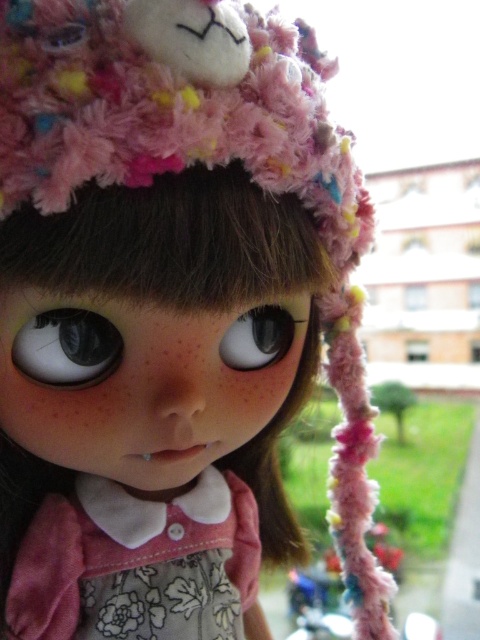
Please describe the position of the matte black eye at center in terms of coordinates. The answer should be in the format of coordinates in parentheses. The coordinate system is normalized, where the origin is at the bottom left corner of the image, and the x and y axes increase to the right and up respectively. The coordinates are given as fractions between 0 and 1.

The matte black eye at center is located at coordinates point (67, 348).

You are a photographer trying to capture a close up of the doll. You want to focus on the floral fabric dress at center and the matte black eye at center. Which object should you adjust your focus on first if you want to ensure the closest part of the doll is sharp?

The floral fabric dress at center is closer to the viewer than the matte black eye at center, so you should focus on the floral fabric dress at center first to ensure the closest part is sharp.

Consider the image. The doll has a floral fabric dress at center and a glossy plastic eye at center. Which part of the doll is bigger in size?

The floral fabric dress at center is larger in size than the glossy plastic eye at center.